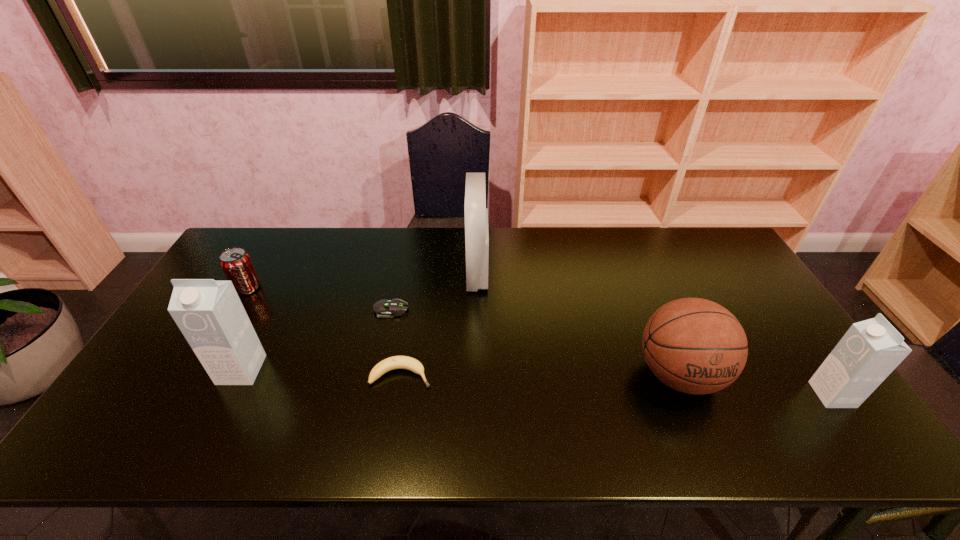
This screenshot has height=540, width=960. I want to click on the left carton, so click(x=210, y=315).

The height and width of the screenshot is (540, 960). I want to click on the taller carton, so click(210, 315).

Find the location of `the shorter carton`. the shorter carton is located at coordinates (870, 350).

At what (x,y) coordinates should I click in order to perform the action: click on the rightmost object. Please return your answer as a coordinate pair (x, y). This screenshot has height=540, width=960. Looking at the image, I should click on (870, 350).

Where is `the leftmost object`? the leftmost object is located at coordinates (236, 263).

Find the location of a particular element. This screenshot has width=960, height=540. pop soda is located at coordinates (236, 263).

Identify the location of computer mouse. Image resolution: width=960 pixels, height=540 pixels. (384, 308).

At what (x,y) coordinates should I click in order to perform the action: click on the third farthest object. Please return your answer as a coordinate pair (x, y). Looking at the image, I should click on (384, 308).

This screenshot has width=960, height=540. In order to click on the fifth object from left to right in this screenshot , I will do `click(476, 214)`.

Where is `banana`? Image resolution: width=960 pixels, height=540 pixels. banana is located at coordinates [396, 362].